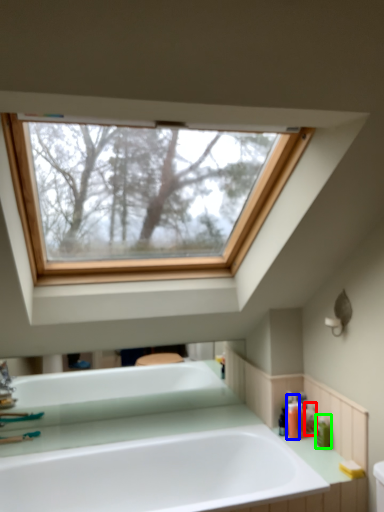
Question: Based on their relative distances, which object is nearer to toiletry (highlighted by a red box)? Choose from toiletry (highlighted by a blue box) and toiletry (highlighted by a green box).

Choices:
 (A) toiletry
 (B) toiletry

Answer: (B)